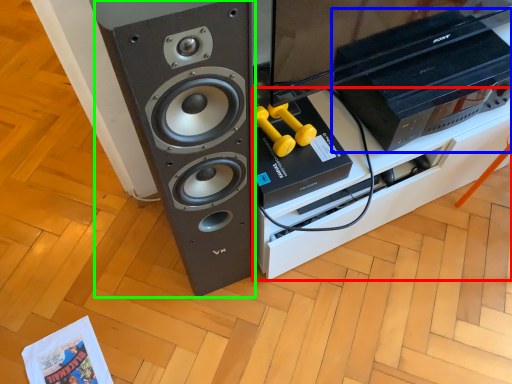
Question: Estimate the real-world distances between objects in this image. Which object is farther from furniture (highlighted by a red box), home appliance (highlighted by a blue box) or speaker (highlighted by a green box)?

Choices:
 (A) home appliance
 (B) speaker

Answer: (B)